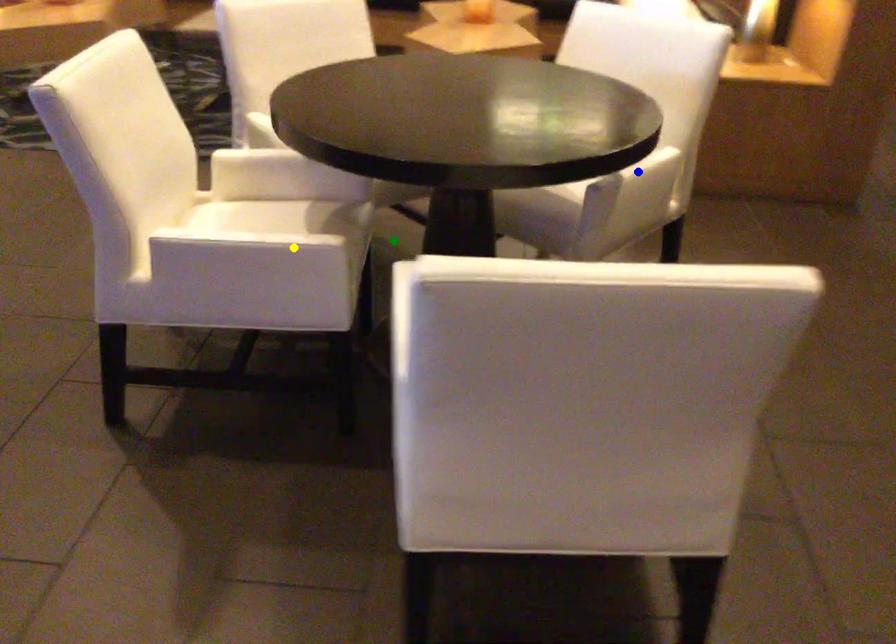
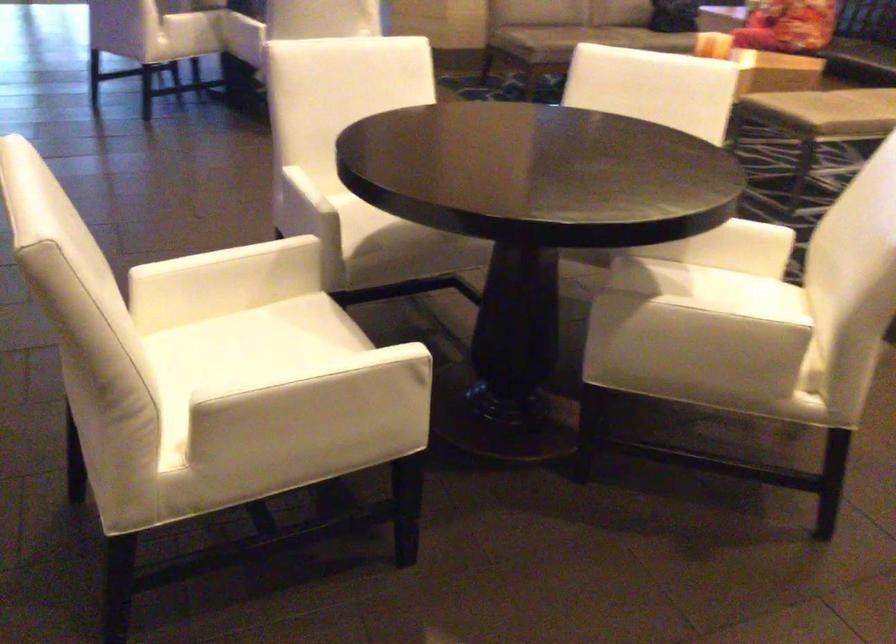
I am providing you with two images of the same scene from different viewpoints. Three points are marked in image1. Which point corresponds to a part or object that is occluded in image2?In image1, three points are marked. Which of them correspond to a part or object that is occluded in image2?Among the three points shown in image1, which one corresponds to a part or object that is no longer visible due to occlusion in image2?

green point cannot be seen in image2.